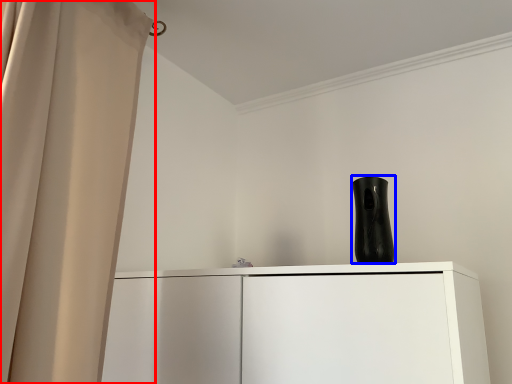
Question: Which object is further to the camera taking this photo, curtain (highlighted by a red box) or vase (highlighted by a blue box)?

Choices:
 (A) curtain
 (B) vase

Answer: (B)